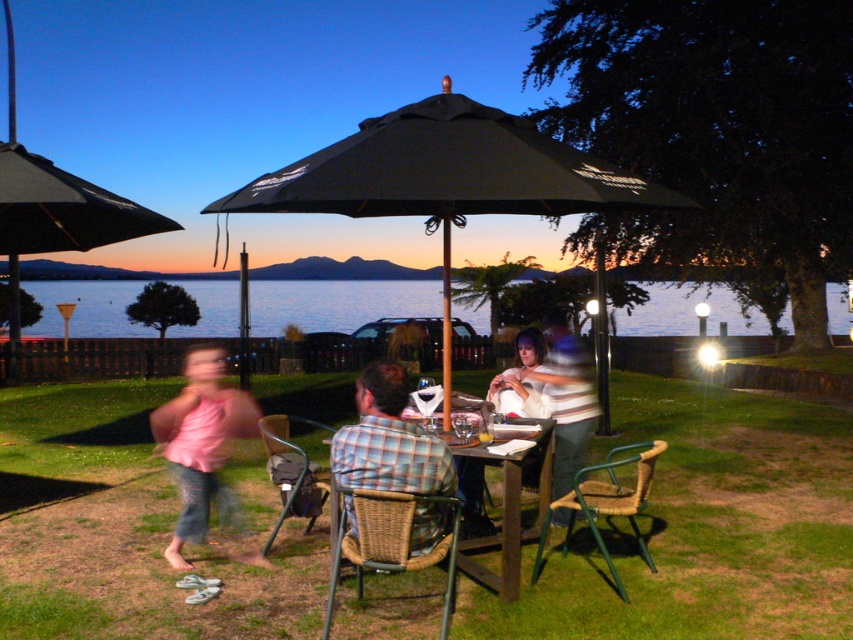
Between wooden table at center and green wicker chair at lower center, which one has more height?

wooden table at center is taller.

This screenshot has height=640, width=853. Describe the element at coordinates (514, 518) in the screenshot. I see `wooden table at center` at that location.

What do you see at coordinates (514, 518) in the screenshot?
I see `wooden table at center` at bounding box center [514, 518].

Find the location of a particular element. The height and width of the screenshot is (640, 853). wooden table at center is located at coordinates (514, 518).

Does woven wicker chair at center have a greater height compared to wooden table at center?

No, woven wicker chair at center is not taller than wooden table at center.

Where is `woven wicker chair at center`? woven wicker chair at center is located at coordinates (390, 541).

The image size is (853, 640). Identify the location of woven wicker chair at center. (390, 541).

Which of these two, blue water at center or plaid fabric shirt at center, stands taller?

With more height is blue water at center.

Is blue water at center wider than plaid fabric shirt at center?

Indeed, blue water at center has a greater width compared to plaid fabric shirt at center.

Image resolution: width=853 pixels, height=640 pixels. Describe the element at coordinates (337, 304) in the screenshot. I see `blue water at center` at that location.

I want to click on blue water at center, so tap(337, 304).